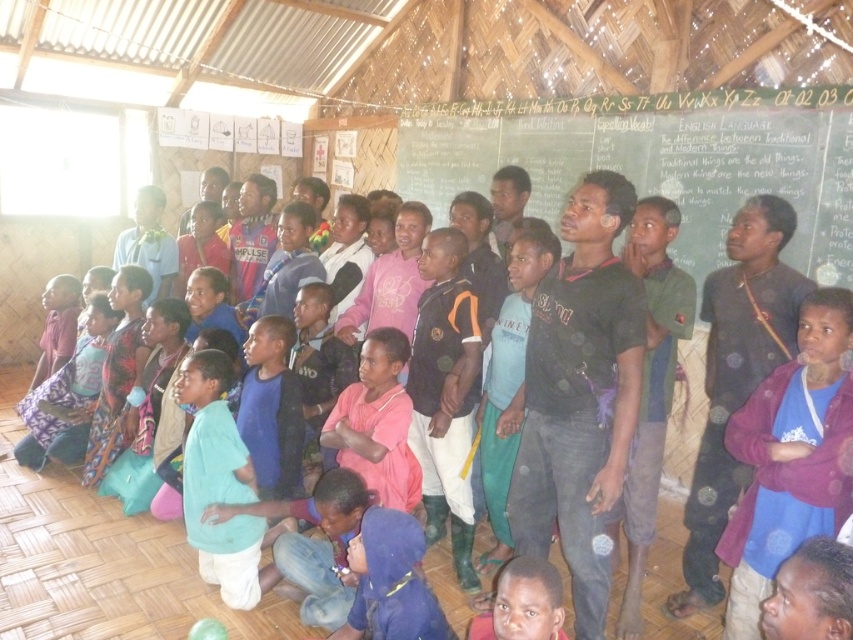
Question: Does pink fabric at center appear under purple fleece jacket at right?

Choices:
 (A) yes
 (B) no

Answer: (A)

Question: Which point is closer to the camera taking this photo?

Choices:
 (A) (585, 449)
 (B) (776, 412)
 (C) (271, 612)
 (D) (485, 152)

Answer: (B)

Question: Does pink fabric at center appear on the right side of black matte shirt at center?

Choices:
 (A) yes
 (B) no

Answer: (B)

Question: Can you confirm if green chalkboard at upper center is thinner than pink fabric at center?

Choices:
 (A) yes
 (B) no

Answer: (B)

Question: Which object is closer to the camera taking this photo?

Choices:
 (A) pink fabric at center
 (B) green chalkboard at upper center
 (C) black matte shirt at center
 (D) purple fleece jacket at right

Answer: (D)

Question: Among these points, which one is farthest from the camera?

Choices:
 (A) (804, 516)
 (B) (692, 184)
 (C) (59, 531)
 (D) (589, 173)

Answer: (B)